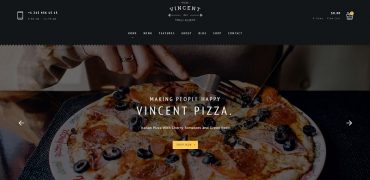
You are a GUI agent. You are given a task and a screenshot of the screen. Output one action in this format:
    pyautogui.click(x=<x>, y=<y>)
    Task: Click on the fork
    The height and width of the screenshot is (180, 370).
    Given the screenshot: What is the action you would take?
    pyautogui.click(x=208, y=81)